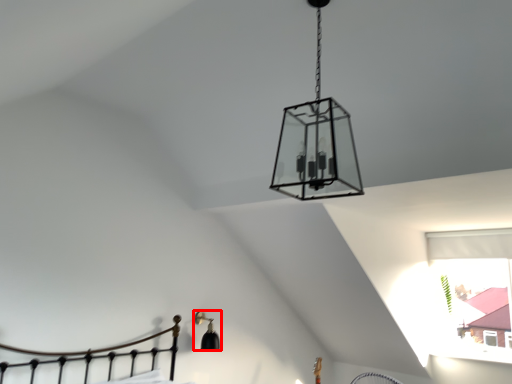
Question: From the image's perspective, where is lamp (annotated by the red box) located in relation to lamp in the image?

Choices:
 (A) below
 (B) above

Answer: (A)